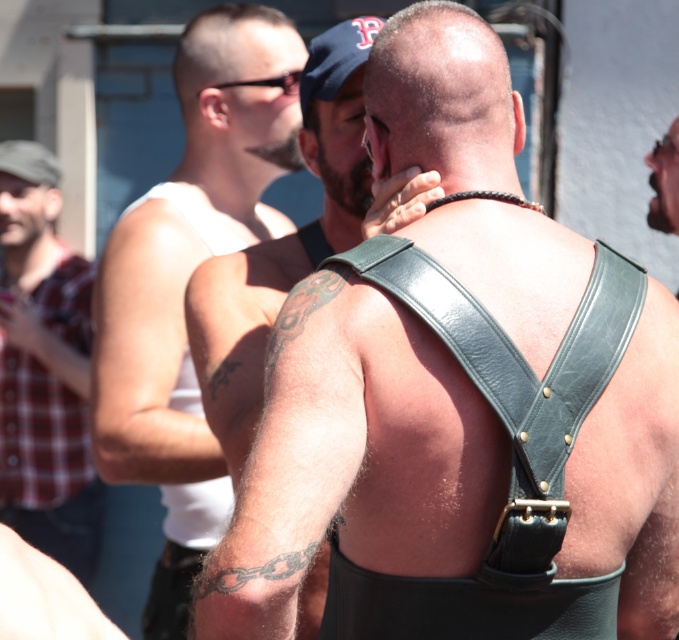
Does point (502, 259) come farther from viewer compared to point (270, 388)?

Yes, point (502, 259) is behind point (270, 388).

Which is in front, point (411, 570) or point (310, 292)?

Point (411, 570)

Which is in front, point (240, 628) or point (293, 308)?

Point (240, 628) is in front.

Find the location of a particular element. The image size is (679, 640). leather harness at center is located at coordinates (369, 449).

Does point (196, 577) come behind point (217, 369)?

Yes, it is.

Is point (299, 552) closer to camera compared to point (215, 381)?

Yes, it is in front of point (215, 381).

I want to click on black ink chain at lower left, so (x=253, y=572).

Is point (610, 433) less distant than point (669, 193)?

Yes, it is.

From the picture: Is leather harness at center to the left of leather harness at right from the viewer's perspective?

Yes, leather harness at center is to the left of leather harness at right.

I want to click on leather harness at center, so click(x=369, y=449).